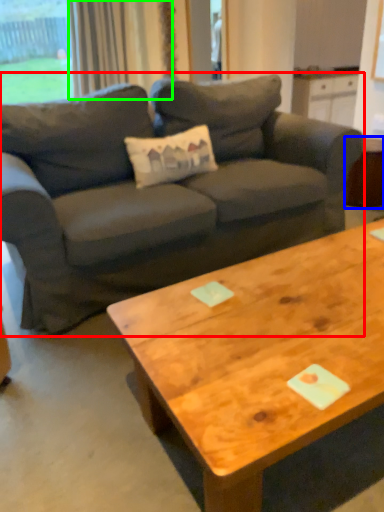
Question: Based on their relative distances, which object is nearer to studio couch (highlighted by a red box)? Choose from side table (highlighted by a blue box) and curtain (highlighted by a green box).

Choices:
 (A) side table
 (B) curtain

Answer: (A)